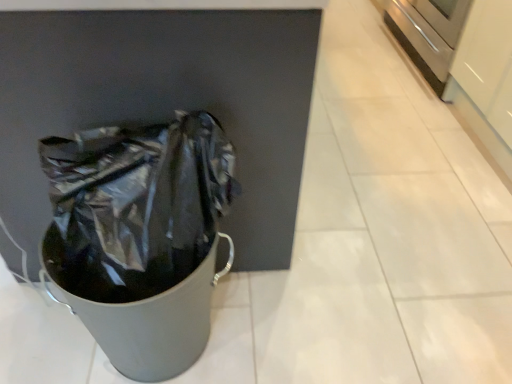
Describe the element at coordinates (428, 34) in the screenshot. I see `satin stainless steel oven at right` at that location.

Measure the distance between point (451, 54) and camera.

A distance of 6.73 feet exists between point (451, 54) and camera.

In the scene shown: What is the approximate width of satin stainless steel oven at right?

It is 53.36 centimeters.

Locate an element on the screen. The height and width of the screenshot is (384, 512). satin stainless steel oven at right is located at coordinates (428, 34).

The height and width of the screenshot is (384, 512). I want to click on satin stainless steel oven at right, so click(428, 34).